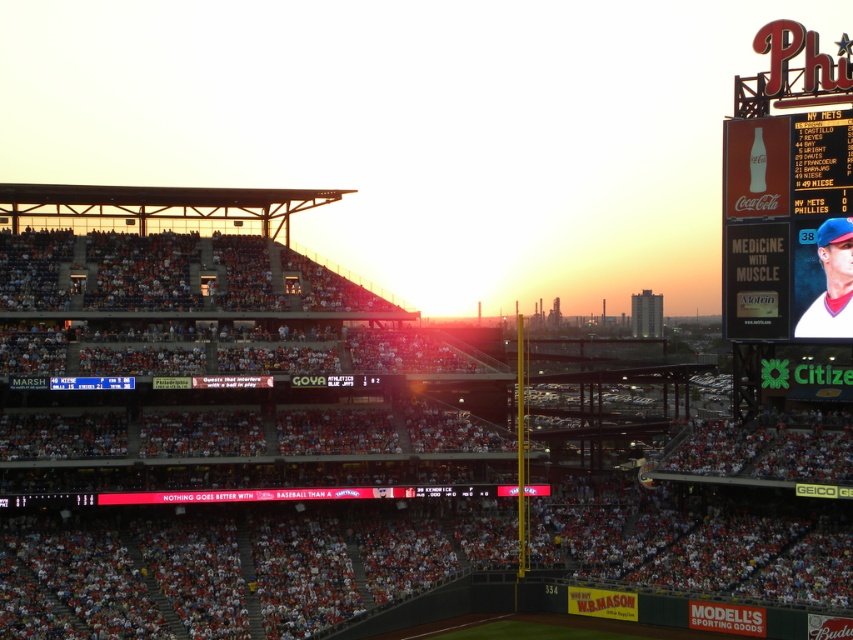
Question: Is white jersey baseball player at upper right behind red plastic scoreboard at upper right?

Choices:
 (A) yes
 (B) no

Answer: (B)

Question: Does white jersey baseball player at upper right lie behind red plastic scoreboard at upper right?

Choices:
 (A) yes
 (B) no

Answer: (B)

Question: Which point is closer to the camera taking this photo?

Choices:
 (A) (811, 128)
 (B) (340, 548)

Answer: (B)

Question: Can you confirm if white jersey baseball player at upper right is positioned to the left of red plastic scoreboard at upper right?

Choices:
 (A) no
 (B) yes

Answer: (B)

Question: Which object is closer to the camera taking this photo?

Choices:
 (A) white jersey baseball player at upper right
 (B) red plastic scoreboard at upper right

Answer: (A)